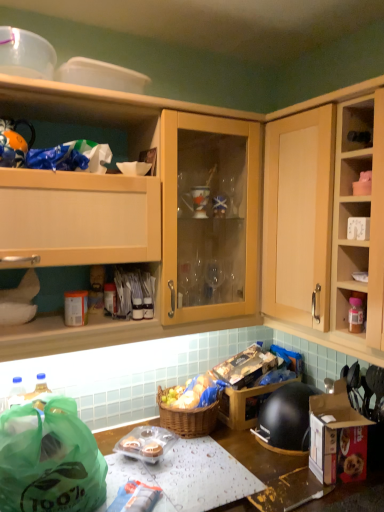
Question: Is matte wood cabinet at upper left, the 2th cabinetry when ordered from right to left, oriented towards matte plastic container at upper right?

Choices:
 (A) yes
 (B) no

Answer: (A)

Question: Is matte wood cabinet at upper left, the 2th cabinetry when ordered from right to left, directly adjacent to matte plastic container at upper right?

Choices:
 (A) no
 (B) yes

Answer: (A)

Question: Considering the relative sizes of matte wood cabinet at upper left, acting as the first cabinetry starting from the left, and matte plastic container at upper right in the image provided, is matte wood cabinet at upper left, acting as the first cabinetry starting from the left, smaller than matte plastic container at upper right?

Choices:
 (A) yes
 (B) no

Answer: (B)

Question: Does matte wood cabinet at upper left, acting as the first cabinetry starting from the left, have a greater width compared to matte plastic container at upper right?

Choices:
 (A) no
 (B) yes

Answer: (B)

Question: Considering the relative sizes of matte wood cabinet at upper left, acting as the first cabinetry starting from the left, and matte plastic container at upper right in the image provided, is matte wood cabinet at upper left, acting as the first cabinetry starting from the left, taller than matte plastic container at upper right?

Choices:
 (A) no
 (B) yes

Answer: (B)

Question: In terms of width, does wooden cabinet at right, the first cabinetry in the right-to-left sequence, look wider or thinner when compared to green plastic bag at lower left?

Choices:
 (A) wide
 (B) thin

Answer: (A)

Question: Visually, is wooden cabinet at right, the first cabinetry in the right-to-left sequence, positioned to the left or to the right of green plastic bag at lower left?

Choices:
 (A) left
 (B) right

Answer: (B)

Question: Is wooden cabinet at right, arranged as the 2th cabinetry when viewed from the left, taller or shorter than green plastic bag at lower left?

Choices:
 (A) tall
 (B) short

Answer: (A)

Question: Considering the positions of point (299, 138) and point (74, 507), is point (299, 138) closer or farther from the camera than point (74, 507)?

Choices:
 (A) closer
 (B) farther

Answer: (B)

Question: Is matte plastic container at upper right bigger or smaller than wooden table at lower center?

Choices:
 (A) small
 (B) big

Answer: (A)

Question: Is matte plastic container at upper right taller or shorter than wooden table at lower center?

Choices:
 (A) tall
 (B) short

Answer: (B)

Question: From the image's perspective, relative to wooden table at lower center, is matte plastic container at upper right above or below?

Choices:
 (A) above
 (B) below

Answer: (A)

Question: Considering the positions of point (354, 115) and point (327, 496), is point (354, 115) closer or farther from the camera than point (327, 496)?

Choices:
 (A) farther
 (B) closer

Answer: (B)

Question: From the image's perspective, relative to wooden cabinet at right, the first cabinetry in the right-to-left sequence, is wooden table at lower center above or below?

Choices:
 (A) above
 (B) below

Answer: (B)

Question: Choose the correct answer: Is wooden table at lower center inside wooden cabinet at right, the first cabinetry in the right-to-left sequence, or outside it?

Choices:
 (A) outside
 (B) inside

Answer: (A)